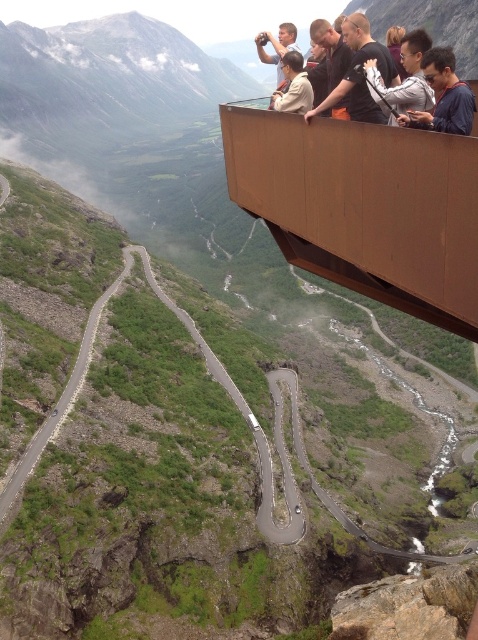
Who is higher up, brown wood balcony at upper center or matte black jacket at upper center?

Positioned higher is matte black jacket at upper center.

Is brown wood balcony at upper center wider than matte black jacket at upper center?

Correct, the width of brown wood balcony at upper center exceeds that of matte black jacket at upper center.

Between point (333, 182) and point (416, 48), which one is positioned in front?

Point (333, 182)

Image resolution: width=478 pixels, height=640 pixels. Identify the location of brown wood balcony at upper center. (365, 208).

Can you confirm if matte black jacket at upper center is taller than light brown jacket at center?

In fact, matte black jacket at upper center may be shorter than light brown jacket at center.

Which is more to the right, matte black jacket at upper center or light brown jacket at center?

matte black jacket at upper center is more to the right.

Does point (372, 81) come closer to viewer compared to point (300, 104)?

Yes, point (372, 81) is closer to viewer.

Locate an element on the screen. This screenshot has width=478, height=640. matte black jacket at upper center is located at coordinates (403, 77).

Which of these two, dark blue shirt at upper center or light brown jacket at center, stands taller?

With more height is dark blue shirt at upper center.

Which is in front, point (468, 67) or point (304, 106)?

Point (304, 106)

Is point (445, 3) behind point (301, 86)?

That is True.

At what (x,y) coordinates should I click in order to perform the action: click on dark blue shirt at upper center. Please return your answer as a coordinate pair (x, y). This screenshot has height=640, width=478. Looking at the image, I should click on (433, 22).